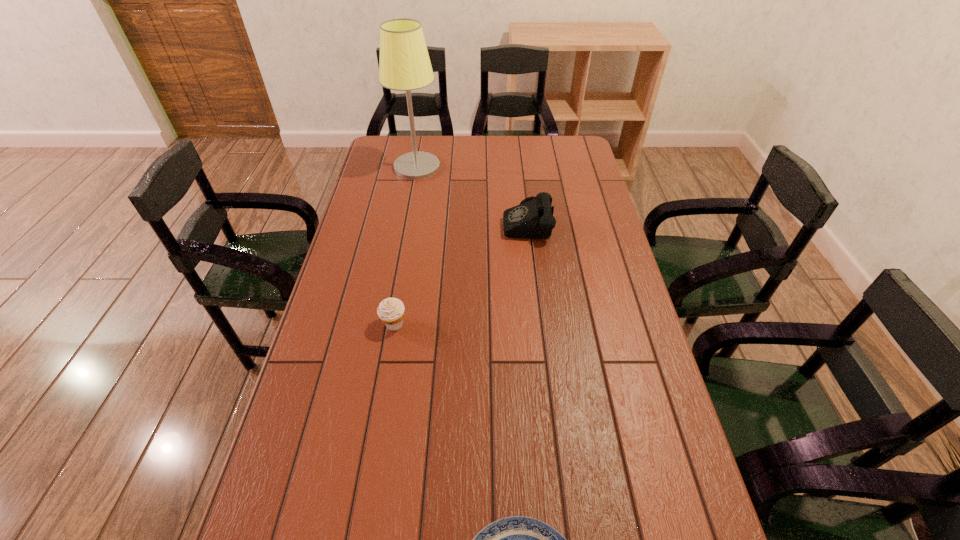
Image resolution: width=960 pixels, height=540 pixels. Identify the location of the tallest object. (405, 65).

The image size is (960, 540). What are the coordinates of `table lamp` in the screenshot? It's located at (405, 65).

I want to click on the second farthest object, so click(x=534, y=219).

What are the coordinates of `muffin` in the screenshot? It's located at (391, 311).

You are a GUI agent. You are given a task and a screenshot of the screen. Output one action in this format:
    pyautogui.click(x=<x>, y=<y>)
    Task: Click on the free space located on the front of the tallest object
    The height and width of the screenshot is (540, 960).
    Given the screenshot: What is the action you would take?
    pyautogui.click(x=409, y=210)

Locate an element on the screen. The width and height of the screenshot is (960, 540). vacant area located 0.390m on the dial of the third nearest object is located at coordinates (395, 221).

The width and height of the screenshot is (960, 540). Find the location of `free location located 0.160m on the dial of the third nearest object`. free location located 0.160m on the dial of the third nearest object is located at coordinates (459, 221).

At what (x,y) coordinates should I click in order to perform the action: click on vacant space located 0.220m on the dial of the third nearest object. Please return your answer as a coordinate pair (x, y). Looking at the image, I should click on (443, 221).

Identify the location of free space located 0.130m on the back of the third farthest object. Image resolution: width=960 pixels, height=540 pixels. (401, 281).

Locate an element on the screen. The height and width of the screenshot is (540, 960). object at the far edge is located at coordinates (405, 65).